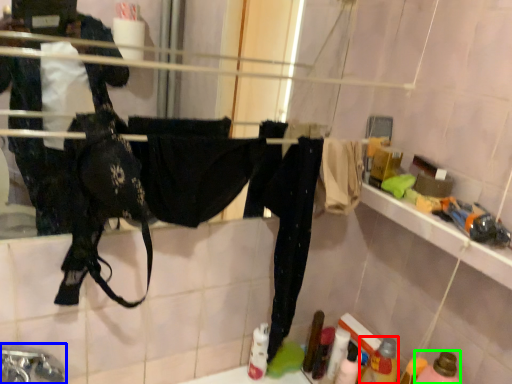
Question: Based on their relative distances, which object is farther from bottle (highlighted by a red box)? Choose from faucet (highlighted by a blue box) and bottle (highlighted by a green box).

Choices:
 (A) faucet
 (B) bottle

Answer: (A)